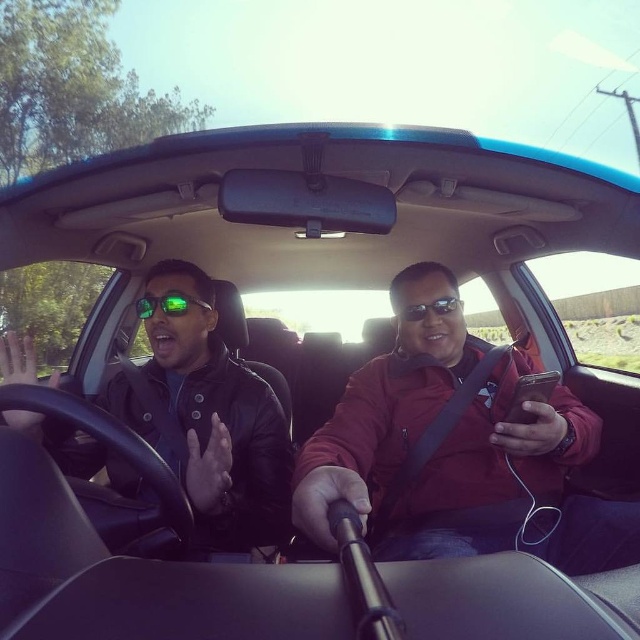
You are a passenger in the car and want to hand the driver your phone. The driver is wearing a black jacket over a dark shirt, and the passenger is wearing the matte red jacket at center. Based on their positions, which direction should you move to pass the phone to the driver?

Since the matte red jacket at center is positioned at point (438, 438), you should move towards the left to pass the phone to the driver who is on the left side of the car.

You are a delivery robot with a 36 inch wide package. You need to place it between the matte red jacket at center and the green reflective lenses at center in the car. Is there enough space?

The distance between the matte red jacket at center and the green reflective lenses at center is 36.16 inches. Since the package is 36 inches wide, there is just enough space to place it between them with minimal clearance.

You are a passenger in the car and need to determine which object is bigger between the leather jacket at left and the green reflective lenses at center. Which one is larger?

The leather jacket at left is larger than the green reflective lenses at center.